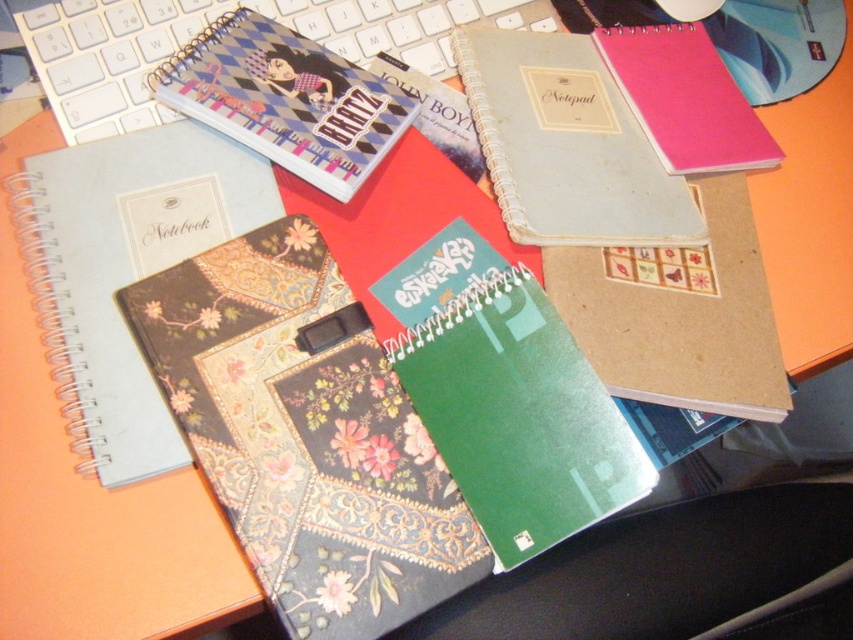
Who is taller, light blue paper notepad at center or pink matte notebook at upper right?

With more height is light blue paper notepad at center.

Can you confirm if light blue paper notepad at center is taller than pink matte notebook at upper right?

Yes.

Does point (492, 97) come farther from viewer compared to point (769, 140)?

No, it is in front of (769, 140).

Where is `light blue paper notepad at center`? light blue paper notepad at center is located at coordinates (567, 145).

Who is taller, floral-patterned fabric binder at center or matte floral notebook at left?

matte floral notebook at left

Who is more forward, (312, 308) or (149, 218)?

Point (312, 308)

In order to click on floral-patterned fabric binder at center in this screenshot , I will do `click(305, 433)`.

Is matte floral notebook at left shorter than light blue paper notepad at center?

No.

Which is in front, point (108, 438) or point (453, 32)?

Point (108, 438) is in front.

This screenshot has height=640, width=853. In order to click on matte floral notebook at left in this screenshot , I will do `click(125, 269)`.